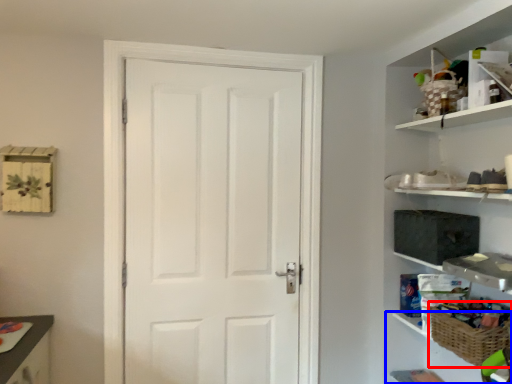
Question: Which point is further to the camera, basket (highlighted by a red box) or cabinet (highlighted by a blue box)?

Choices:
 (A) basket
 (B) cabinet

Answer: (B)